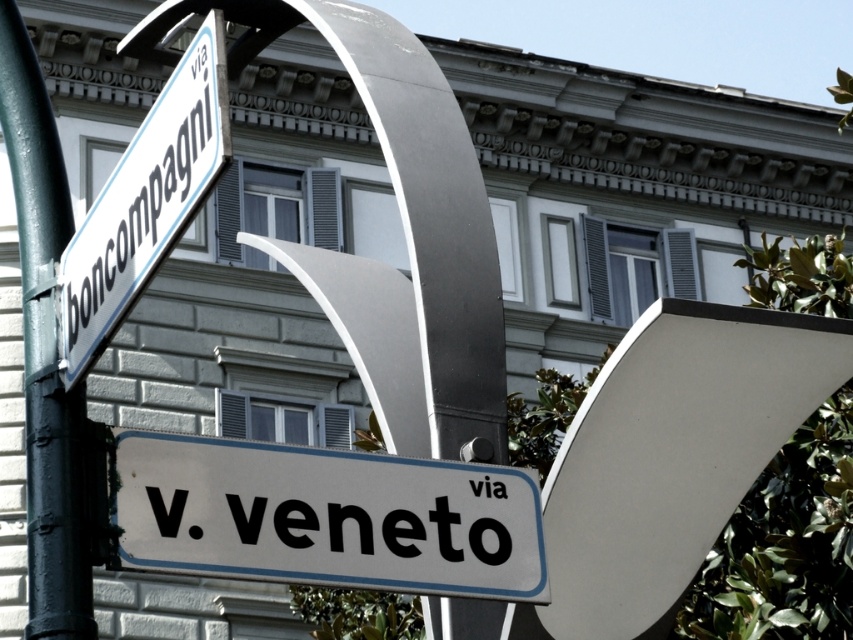
Who is higher up, green painted metal pole at left or white plastic street sign at upper left?

Positioned higher is white plastic street sign at upper left.

Measure the distance between green painted metal pole at left and camera.

green painted metal pole at left and camera are 46.42 feet apart.

Who is more distant from viewer, (9, 16) or (126, 232)?

The point (9, 16) is more distant.

Where is `green painted metal pole at left`? The height and width of the screenshot is (640, 853). green painted metal pole at left is located at coordinates (45, 352).

Who is higher up, white plastic street sign at center or white plastic street sign at upper left?

white plastic street sign at upper left

Is point (537, 499) closer to camera compared to point (184, 192)?

No, (537, 499) is behind (184, 192).

Find the location of a particular element. This screenshot has height=640, width=853. white plastic street sign at center is located at coordinates (326, 516).

Can you confirm if white plastic street sign at center is positioned to the right of green painted metal pole at left?

Correct, you'll find white plastic street sign at center to the right of green painted metal pole at left.

Between white plastic street sign at center and green painted metal pole at left, which one appears on the left side from the viewer's perspective?

From the viewer's perspective, green painted metal pole at left appears more on the left side.

The height and width of the screenshot is (640, 853). I want to click on white plastic street sign at center, so click(326, 516).

This screenshot has height=640, width=853. Identify the location of white plastic street sign at center. (326, 516).